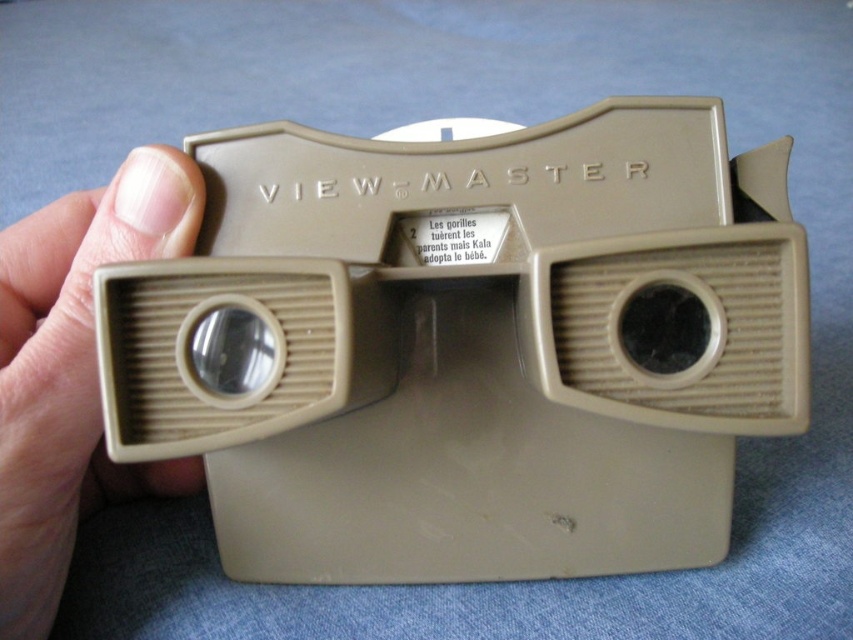
You are standing in front of the beige View Master viewer. There is a point at coordinates point (45, 445). Can you reach it without moving your hand?

The point at (45, 445) is 19.67 inches away from the viewer, so you cannot reach it without moving your hand.

You are a photographer adjusting lighting for a product shoot. You notice the pink skin at left and the matte plastic lens at center left. Which object should you focus on if you want to highlight the taller one?

The pink skin at left is taller than the matte plastic lens at center left, so you should focus on the pink skin at left to highlight the taller one.